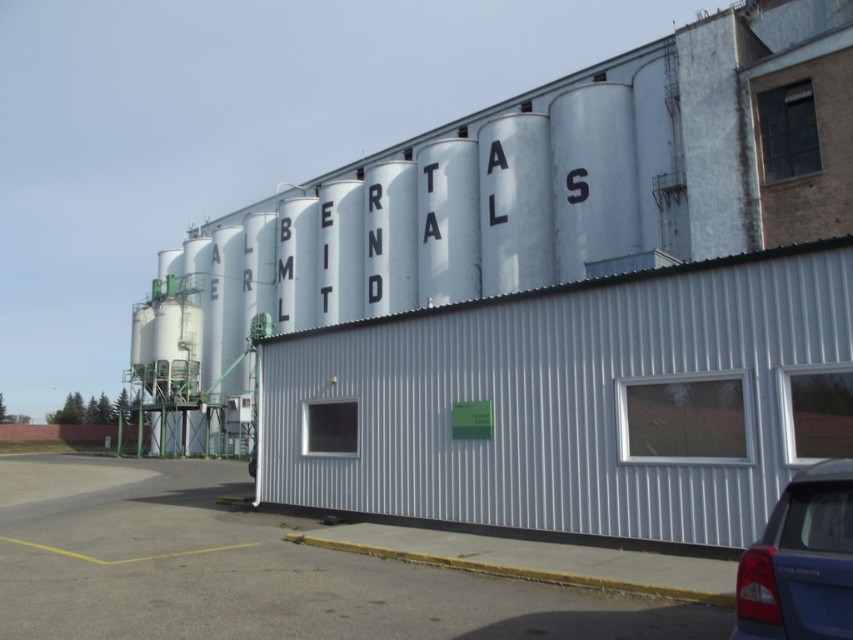
Question: Is gray asphalt at lower left above blue matte sedan at lower right?

Choices:
 (A) yes
 (B) no

Answer: (B)

Question: Which point is farther to the camera?

Choices:
 (A) gray asphalt at lower left
 (B) blue matte sedan at lower right

Answer: (A)

Question: Can you confirm if gray asphalt at lower left is positioned to the left of blue matte sedan at lower right?

Choices:
 (A) yes
 (B) no

Answer: (A)

Question: Which point is closer to the camera?

Choices:
 (A) blue matte sedan at lower right
 (B) gray asphalt at lower left

Answer: (A)

Question: Which object appears closest to the camera in this image?

Choices:
 (A) blue matte sedan at lower right
 (B) gray asphalt at lower left

Answer: (A)

Question: Is gray asphalt at lower left below blue matte sedan at lower right?

Choices:
 (A) yes
 (B) no

Answer: (A)